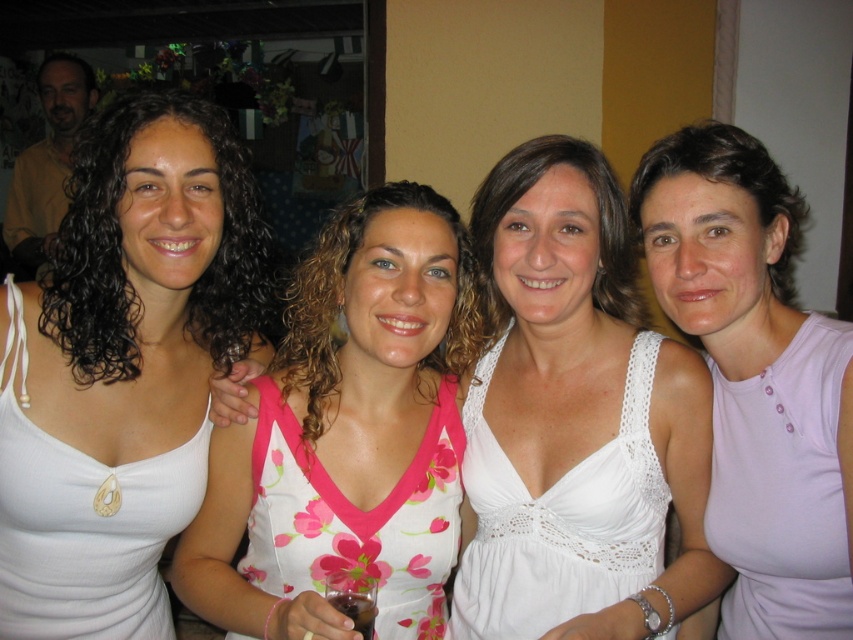
Question: Can you confirm if white lace dress at center is wider than white floral fabric dress at center?

Choices:
 (A) yes
 (B) no

Answer: (B)

Question: Estimate the real-world distances between objects in this image. Which object is farther from the purple matte tank top at right?

Choices:
 (A) white floral fabric dress at center
 (B) white fabric dress at left
 (C) pink floral dress at center

Answer: (B)

Question: Which object is the closest to the white lace dress at center?

Choices:
 (A) transparent plastic wine glass at lower center
 (B) floral fabric dress at center
 (C) pink fabric tank top at right

Answer: (B)

Question: Is white lace dress at center bigger than white floral fabric dress at center?

Choices:
 (A) no
 (B) yes

Answer: (A)

Question: Which point appears farthest from the camera in this image?

Choices:
 (A) (733, 403)
 (B) (428, 532)

Answer: (A)

Question: Does white fabric dress at left have a lesser width compared to transparent plastic wine glass at lower center?

Choices:
 (A) no
 (B) yes

Answer: (A)